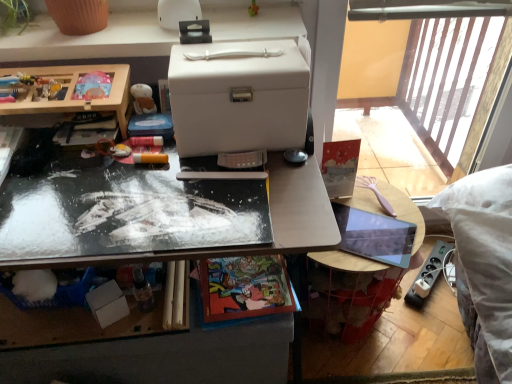
What do you see at coordinates (238, 98) in the screenshot? The image size is (512, 384). I see `white matte box at center` at bounding box center [238, 98].

This screenshot has width=512, height=384. Describe the element at coordinates (73, 91) in the screenshot. I see `wooden toy box at left, which is counted as the 2th desk, starting from the bottom` at that location.

At what (x,y) coordinates should I click in order to perform the action: click on wooden toy box at left, which is counted as the 2th desk, starting from the bottom. Please return your answer as a coordinate pair (x, y). Image resolution: width=512 pixels, height=384 pixels. Looking at the image, I should click on (73, 91).

This screenshot has height=384, width=512. What are the coordinates of `white plastic storage box at upper center, placed as the third desk when sorted from bottom to top` in the screenshot? It's located at (90, 40).

The width and height of the screenshot is (512, 384). What do you see at coordinates (90, 40) in the screenshot? I see `white plastic storage box at upper center, the first desk viewed from the top` at bounding box center [90, 40].

At what (x,y) coordinates should I click in order to perform the action: click on white matte box at center. Please return your answer as a coordinate pair (x, y). This screenshot has height=384, width=512. Looking at the image, I should click on (238, 98).

Is wooden toy box at left, which is counted as the 2th desk, starting from the bottom, surrounding white plastic storage box at upper center, placed as the third desk when sorted from bottom to top?

No.

Where is `the 1st desk positioned below the white plastic storage box at upper center, the first desk viewed from the top (from a real-world perspective)`? the 1st desk positioned below the white plastic storage box at upper center, the first desk viewed from the top (from a real-world perspective) is located at coordinates (73, 91).

Which object is positioned more to the left, wooden toy box at left, which is counted as the 2th desk, starting from the bottom, or white plastic storage box at upper center, placed as the third desk when sorted from bottom to top?

wooden toy box at left, which is counted as the 2th desk, starting from the bottom, is more to the left.

From a real-world perspective, which is physically above, wooden toy box at left, the 2th desk positioned from the top, or white plastic storage box at upper center, the first desk viewed from the top?

white plastic storage box at upper center, the first desk viewed from the top.

What's the angular difference between smooth wooden table at right and white plastic storage box at upper center, placed as the third desk when sorted from bottom to top,'s facing directions?

There is a 29.5-degree angle between the facing directions of smooth wooden table at right and white plastic storage box at upper center, placed as the third desk when sorted from bottom to top.

Is smooth wooden table at right positioned with its back to white plastic storage box at upper center, the first desk viewed from the top?

No.

Does point (358, 177) come closer to viewer compared to point (160, 33)?

No, (358, 177) is further to viewer.

From the image's perspective, between smooth wooden table at right and white plastic storage box at upper center, the first desk viewed from the top, who is located below?

From the image's view, smooth wooden table at right is below.

Is white matte box at center looking in the opposite direction of white plastic storage box at upper center, placed as the third desk when sorted from bottom to top?

No, white matte box at center's orientation is not away from white plastic storage box at upper center, placed as the third desk when sorted from bottom to top.

Is white matte box at center wider or thinner than white plastic storage box at upper center, the first desk viewed from the top?

In the image, white matte box at center appears to be more narrow than white plastic storage box at upper center, the first desk viewed from the top.

Is white matte box at center taller than white plastic storage box at upper center, placed as the third desk when sorted from bottom to top?

Correct, white matte box at center is much taller as white plastic storage box at upper center, placed as the third desk when sorted from bottom to top.

Is white plastic storage box at upper center, placed as the third desk when sorted from bottom to top, taller than wooden toy box at left, the 2th desk positioned from the top?

No, white plastic storage box at upper center, placed as the third desk when sorted from bottom to top, is not taller than wooden toy box at left, the 2th desk positioned from the top.

Which object is more forward, white plastic storage box at upper center, placed as the third desk when sorted from bottom to top, or wooden toy box at left, the 2th desk positioned from the top?

Positioned in front is wooden toy box at left, the 2th desk positioned from the top.

Which is more to the left, white plastic storage box at upper center, placed as the third desk when sorted from bottom to top, or wooden toy box at left, which is counted as the 2th desk, starting from the bottom?

Positioned to the left is wooden toy box at left, which is counted as the 2th desk, starting from the bottom.

Would you say wooden toy box at left, which is counted as the 2th desk, starting from the bottom, is part of white plastic storage box at upper center, placed as the third desk when sorted from bottom to top,'s contents?

No, wooden toy box at left, which is counted as the 2th desk, starting from the bottom, is located outside of white plastic storage box at upper center, placed as the third desk when sorted from bottom to top.

Could you tell me if wooden toy box at left, the 2th desk positioned from the top, is facing metallic reflective desk at center, which appears as the 3th desk when viewed from the top?

No, wooden toy box at left, the 2th desk positioned from the top, is not facing towards metallic reflective desk at center, which appears as the 3th desk when viewed from the top.

From a real-world perspective, which object stands above the other?

wooden toy box at left, the 2th desk positioned from the top.

How different are the orientations of wooden toy box at left, the 2th desk positioned from the top, and metallic reflective desk at center, which appears as the 3th desk when viewed from the top, in degrees?

There is a 1.84-degree angle between the facing directions of wooden toy box at left, the 2th desk positioned from the top, and metallic reflective desk at center, which appears as the 3th desk when viewed from the top.

In the scene shown: Who is bigger, wooden toy box at left, which is counted as the 2th desk, starting from the bottom, or metallic reflective desk at center, which appears as the 3th desk when viewed from the top?

With larger size is metallic reflective desk at center, which appears as the 3th desk when viewed from the top.

From a real-world perspective, who is located higher, white matte box at center or metallic reflective desk at center, which is counted as the first desk, starting from the bottom?

white matte box at center is physically above.

Does white matte box at center touch metallic reflective desk at center, which appears as the 3th desk when viewed from the top?

There is a gap between white matte box at center and metallic reflective desk at center, which appears as the 3th desk when viewed from the top.

From the image's perspective, would you say white matte box at center is shown under metallic reflective desk at center, which is counted as the first desk, starting from the bottom?

No.

From the image's perspective, does white matte box at center appear lower than wooden toy box at left, the 2th desk positioned from the top?

No.

Considering the relative positions of white matte box at center and wooden toy box at left, which is counted as the 2th desk, starting from the bottom, in the image provided, is white matte box at center behind wooden toy box at left, which is counted as the 2th desk, starting from the bottom,?

No, the depth of white matte box at center is less than that of wooden toy box at left, which is counted as the 2th desk, starting from the bottom.

Looking at the image, does white matte box at center seem bigger or smaller compared to wooden toy box at left, the 2th desk positioned from the top?

In the image, white matte box at center appears to be larger than wooden toy box at left, the 2th desk positioned from the top.

From a real-world perspective, starting from the white plastic storage box at upper center, the first desk viewed from the top, which desk is the 1st one below it? Please provide its 2D coordinates.

[(73, 91)]

Find the location of a particular element. table that appears below the white plastic storage box at upper center, placed as the third desk when sorted from bottom to top (from the image's perspective) is located at coordinates (407, 219).

From the image, which object appears to be nearer to white plastic storage box at upper center, the first desk viewed from the top, wooden toy box at left, the 2th desk positioned from the top, or smooth wooden table at right?

Among the two, wooden toy box at left, the 2th desk positioned from the top, is located nearer to white plastic storage box at upper center, the first desk viewed from the top.

Estimate the real-world distances between objects in this image. Which object is further from white matte box at center, white plastic storage box at upper center, placed as the third desk when sorted from bottom to top, or wooden toy box at left, the 2th desk positioned from the top?

wooden toy box at left, the 2th desk positioned from the top, is further to white matte box at center.

When comparing their distances from metallic reflective desk at center, which is counted as the first desk, starting from the bottom, does wooden toy box at left, the 2th desk positioned from the top, or smooth wooden table at right seem closer?

wooden toy box at left, the 2th desk positioned from the top, is closer to metallic reflective desk at center, which is counted as the first desk, starting from the bottom.

Based on their spatial positions, is white plastic storage box at upper center, placed as the third desk when sorted from bottom to top, or wooden toy box at left, the 2th desk positioned from the top, further from smooth wooden table at right?

Based on the image, wooden toy box at left, the 2th desk positioned from the top, appears to be further to smooth wooden table at right.

Based on their spatial positions, is white matte box at center or smooth wooden table at right further from white plastic storage box at upper center, placed as the third desk when sorted from bottom to top?

smooth wooden table at right.

Considering their positions, is white matte box at center positioned further to wooden toy box at left, the 2th desk positioned from the top, than white plastic storage box at upper center, placed as the third desk when sorted from bottom to top?

white matte box at center.

From the image, which object appears to be nearer to white plastic storage box at upper center, placed as the third desk when sorted from bottom to top, wooden toy box at left, which is counted as the 2th desk, starting from the bottom, or metallic reflective desk at center, which is counted as the first desk, starting from the bottom?

wooden toy box at left, which is counted as the 2th desk, starting from the bottom, is positioned closer to the anchor white plastic storage box at upper center, placed as the third desk when sorted from bottom to top.

Looking at the image, which one is located closer to white matte box at center, metallic reflective desk at center, which appears as the 3th desk when viewed from the top, or smooth wooden table at right?

The object closer to white matte box at center is metallic reflective desk at center, which appears as the 3th desk when viewed from the top.

You are a GUI agent. You are given a task and a screenshot of the screen. Output one action in this format:
    pyautogui.click(x=<x>, y=<y>)
    Task: Click on the desk between white matte box at center and metallic reflective desk at center, which is counted as the first desk, starting from the bottom, vertically
    The image size is (512, 384).
    Given the screenshot: What is the action you would take?
    pyautogui.click(x=73, y=91)

The height and width of the screenshot is (384, 512). I want to click on box between white plastic storage box at upper center, placed as the third desk when sorted from bottom to top, and metallic reflective desk at center, which appears as the 3th desk when viewed from the top, vertically, so click(x=238, y=98).

Locate an element on the screen. box between wooden toy box at left, the 2th desk positioned from the top, and smooth wooden table at right, in the horizontal direction is located at coordinates pyautogui.click(x=238, y=98).

Where is `box located between white plastic storage box at upper center, placed as the third desk when sorted from bottom to top, and smooth wooden table at right in the left-right direction`? The image size is (512, 384). box located between white plastic storage box at upper center, placed as the third desk when sorted from bottom to top, and smooth wooden table at right in the left-right direction is located at coordinates (238, 98).